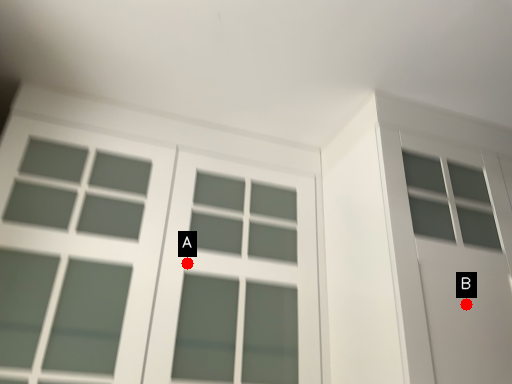
Question: Two points are circled on the image, labeled by A and B beside each circle. Which point appears closest to the camera in this image?

Choices:
 (A) A is closer
 (B) B is closer

Answer: (B)